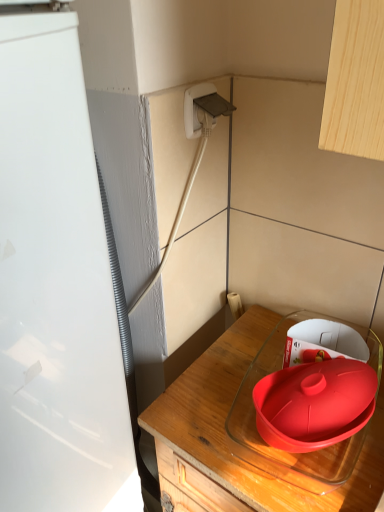
Locate an element on the screen. free point above transparent glass container at lower right (from a real-world perspective) is located at coordinates (250, 401).